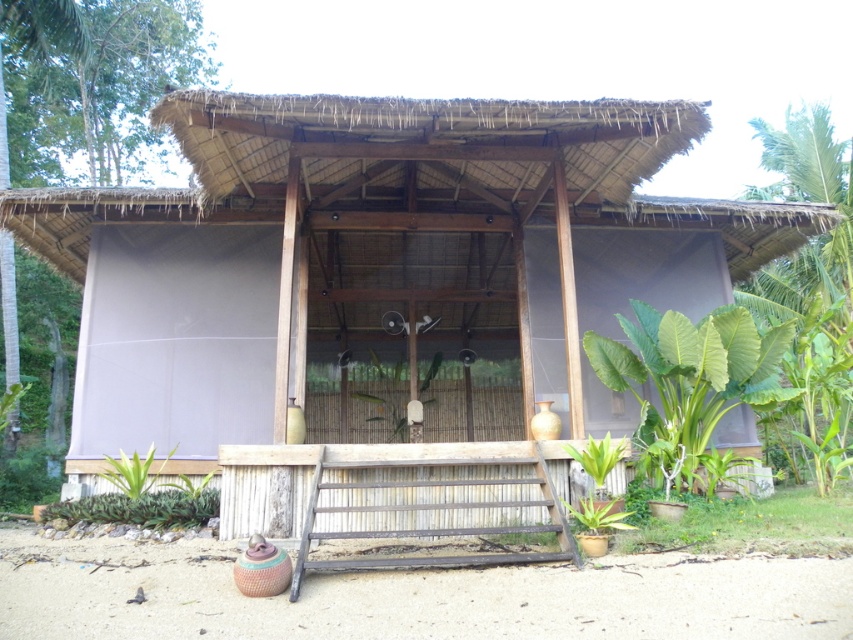
Question: Does wooden hut at center appear on the left side of green leafy plant at lower left?

Choices:
 (A) no
 (B) yes

Answer: (A)

Question: Which of the following is the farthest from the observer?

Choices:
 (A) green leafy plant at right
 (B) wooden hut at center

Answer: (A)

Question: Is green leafy plant at right wider than green leafy plant at lower left?

Choices:
 (A) no
 (B) yes

Answer: (B)

Question: Is wooden hut at center positioned in front of green leafy plant at lower left?

Choices:
 (A) no
 (B) yes

Answer: (B)

Question: Which point appears farthest from the camera in this image?

Choices:
 (A) [641, 308]
 (B) [485, 285]

Answer: (B)

Question: Which object appears farthest from the camera in this image?

Choices:
 (A) wooden hut at center
 (B) green leafy plant at right

Answer: (B)